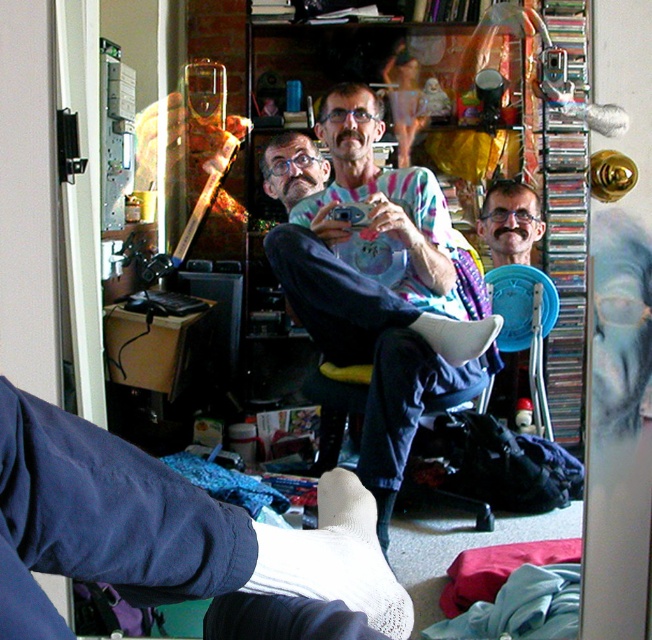
Is white mesh sock at lower center to the left of white fabric chair at center from the viewer's perspective?

Correct, you'll find white mesh sock at lower center to the left of white fabric chair at center.

Can you confirm if white mesh sock at lower center is positioned above white fabric chair at center?

No.

At what (x,y) coordinates should I click in order to perform the action: click on white mesh sock at lower center. Please return your answer as a coordinate pair (x, y). Looking at the image, I should click on (334, 557).

Can you confirm if tie-dye fabric shirt at center is taller than blue plastic chair at center?

Indeed, tie-dye fabric shirt at center has a greater height compared to blue plastic chair at center.

Is point (394, 308) farther from viewer compared to point (522, 328)?

No, it is in front of (522, 328).

Between point (366, 186) and point (486, 291), which one is positioned behind?

The point (486, 291) is behind.

You are a GUI agent. You are given a task and a screenshot of the screen. Output one action in this format:
    pyautogui.click(x=<x>, y=<y>)
    Task: Click on the tie-dye fabric shirt at center
    This screenshot has height=640, width=652.
    Given the screenshot: What is the action you would take?
    pyautogui.click(x=374, y=284)

Who is higher up, matte tie-dye shirt at center or matte black glasses at center?

matte black glasses at center

Is matte tie-dye shirt at center taller than matte black glasses at center?

Incorrect, matte tie-dye shirt at center's height is not larger of matte black glasses at center's.

Is point (489, 236) positioned behind point (308, 193)?

Yes, it is behind point (308, 193).

This screenshot has height=640, width=652. I want to click on matte tie-dye shirt at center, so click(511, 221).